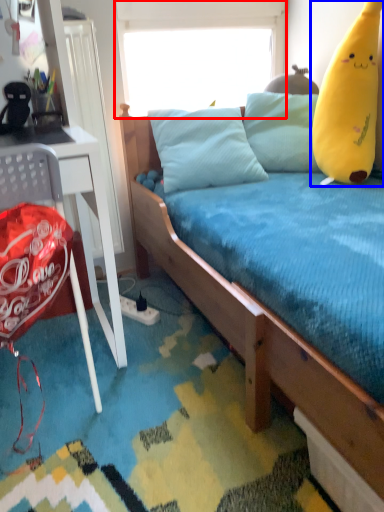
Question: Which point is closer to the camera, window screen (highlighted by a red box) or toy (highlighted by a blue box)?

Choices:
 (A) window screen
 (B) toy

Answer: (B)